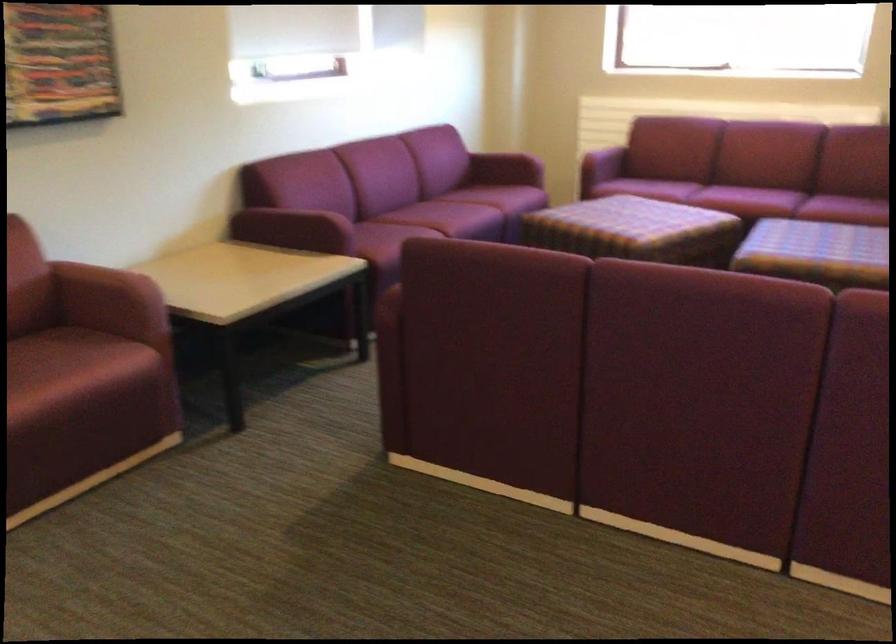
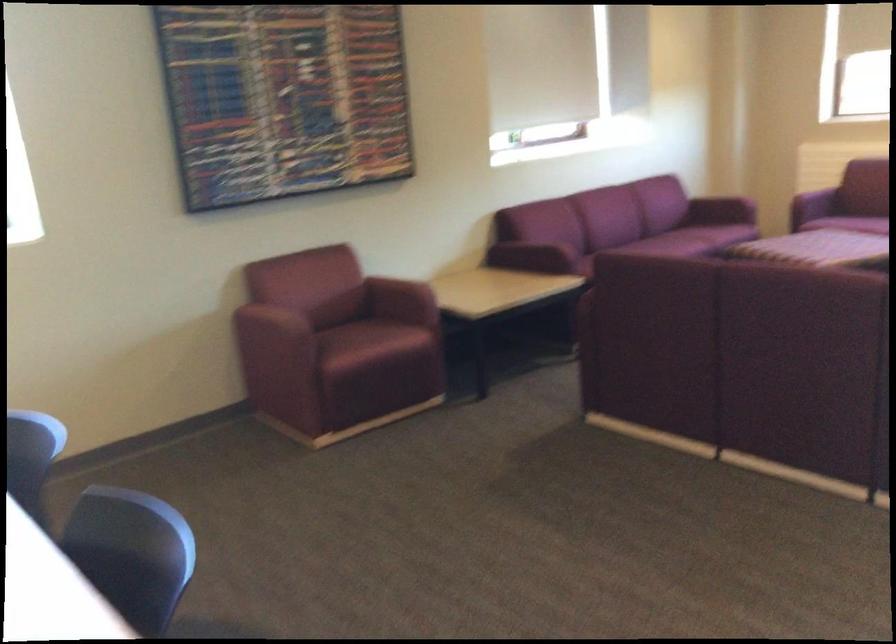
The point at (291, 230) is marked in the first image. Where is the corresponding point in the second image?

(530, 257)